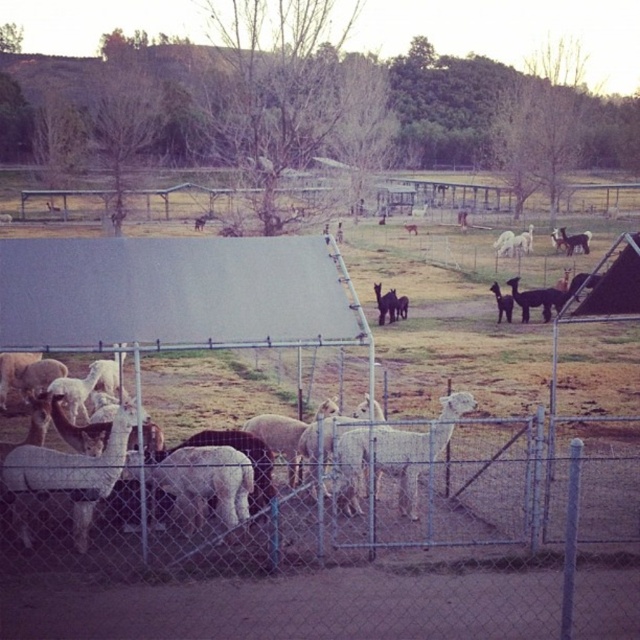
You are standing at the point marked by the coordinate point at point [67,476]. You want to walk towards the large light colored structure in the midground. Which direction should you head?

The point [67,476] indicates a white woolly alpaca at lower left. To reach the large light colored structure in the midground, you should head north.

You are a farmer who wants to feed two alpacas. You have a bag of feed that can cover a 5 feet radius. You see the white woolly alpaca at lower left and the white woolly alpaca at center. Can you feed both of them without moving the bag?

The white woolly alpaca at lower left and white woolly alpaca at center are 7.72 feet apart from each other. Since the distance between them is greater than 5 feet, the bag cannot cover both simultaneously. You need to move the bag to reach both.